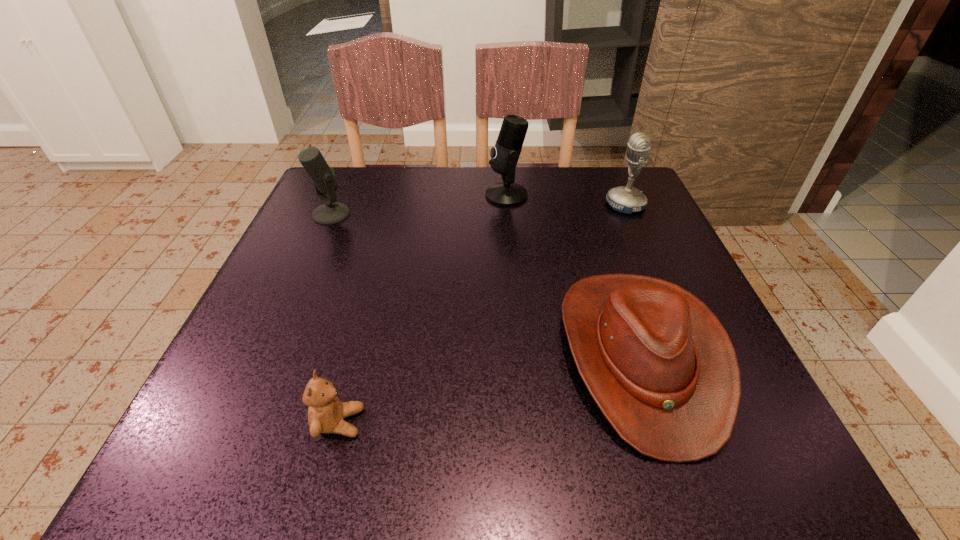
You are a GUI agent. You are given a task and a screenshot of the screen. Output one action in this format:
    pyautogui.click(x=<x>, y=<y>)
    Task: Click on the third object from right to left
    Image resolution: width=960 pixels, height=540 pixels.
    Given the screenshot: What is the action you would take?
    pyautogui.click(x=504, y=156)

This screenshot has width=960, height=540. Find the location of `the rightmost microphone`. the rightmost microphone is located at coordinates (626, 199).

This screenshot has width=960, height=540. Find the location of `the leftmost object`. the leftmost object is located at coordinates (325, 181).

Where is `the second object from left to right`? the second object from left to right is located at coordinates (326, 412).

This screenshot has height=540, width=960. I want to click on cowboy hat, so click(x=658, y=363).

Identify the location of blank area located on the stand of the second microphone from left to right. The image size is (960, 540). (432, 195).

Identify the location of vacant space situated 0.170m on the stand of the second microphone from left to right. (416, 195).

Locate an element on the screen. blank space located 0.120m on the stand of the second microphone from left to right is located at coordinates (436, 195).

You are a GUI agent. You are given a task and a screenshot of the screen. Output one action in this format:
    pyautogui.click(x=<x>, y=<y>)
    Task: Click on the vacant region located 0.210m on the front-facing side of the rightmost microphone
    The height and width of the screenshot is (540, 960).
    Given the screenshot: What is the action you would take?
    pos(516,205)

You are a GUI agent. You are given a task and a screenshot of the screen. Output one action in this format:
    pyautogui.click(x=<x>, y=<y>)
    Task: Click on the vacant region located 0.300m on the front-facing side of the rightmost microphone
    The image size is (960, 540).
    Given the screenshot: What is the action you would take?
    pyautogui.click(x=479, y=205)